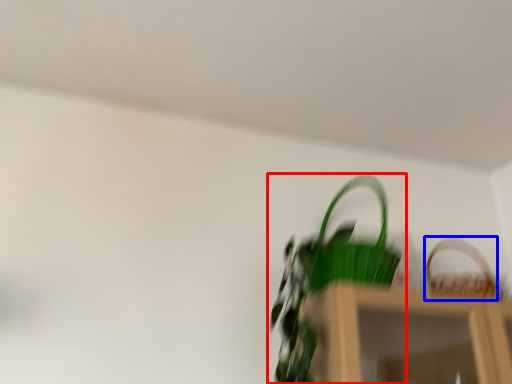
Question: Which object is further to the camera taking this photo, houseplant (highlighted by a red box) or basket (highlighted by a blue box)?

Choices:
 (A) houseplant
 (B) basket

Answer: (B)